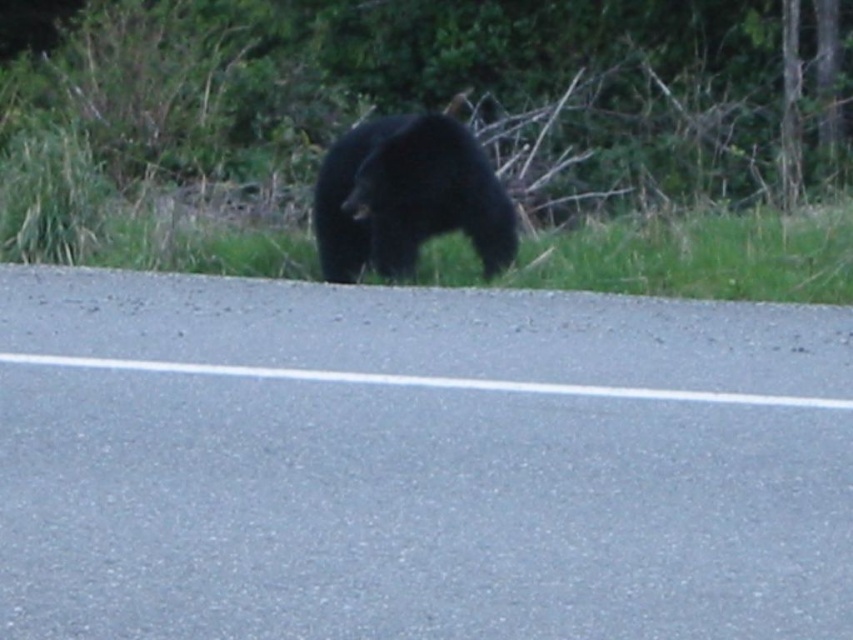
Does asphalt road at center come in front of black fur bear at center?

Yes, asphalt road at center is in front of black fur bear at center.

Does asphalt road at center have a lesser width compared to black fur bear at center?

Incorrect, asphalt road at center's width is not less than black fur bear at center's.

Is point (698, 573) behind point (461, 161)?

No, it is not.

The width and height of the screenshot is (853, 640). In order to click on asphalt road at center in this screenshot , I will do `click(416, 461)`.